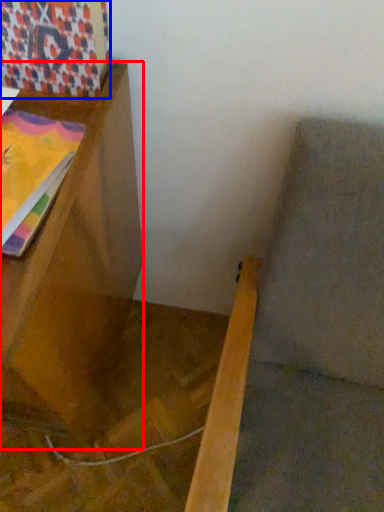
Question: Which object appears closest to the camera in this image, furniture (highlighted by a red box) or tapestry (highlighted by a blue box)?

Choices:
 (A) furniture
 (B) tapestry

Answer: (A)